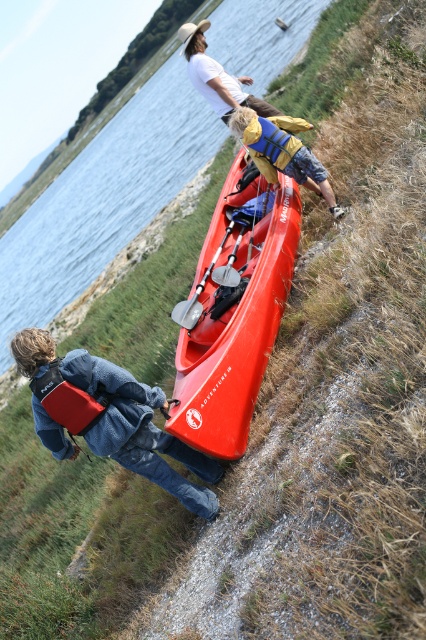
Does yellow life vest at center have a smaller size compared to white cotton shirt at upper center?

Indeed, yellow life vest at center has a smaller size compared to white cotton shirt at upper center.

Between yellow life vest at center and white cotton shirt at upper center, which one is positioned higher?

Positioned higher is white cotton shirt at upper center.

Does point (253, 116) lie behind point (207, 20)?

No.

This screenshot has height=640, width=426. In order to click on yellow life vest at center in this screenshot , I will do `click(282, 150)`.

Is the position of red matte life jacket at lower left more distant than that of silver metallic paddle at center?

No, it is not.

Who is taller, red matte life jacket at lower left or silver metallic paddle at center?

silver metallic paddle at center

Identify the location of red matte life jacket at lower left. (69, 401).

Which is in front, point (273, 163) or point (60, 385)?

Point (60, 385) is more forward.

Based on the photo, does yellow life vest at center appear on the right side of red matte life jacket at lower left?

Indeed, yellow life vest at center is positioned on the right side of red matte life jacket at lower left.

Who is more forward, (233, 131) or (48, 400)?

Point (48, 400) is more forward.

Image resolution: width=426 pixels, height=640 pixels. I want to click on yellow life vest at center, so click(282, 150).